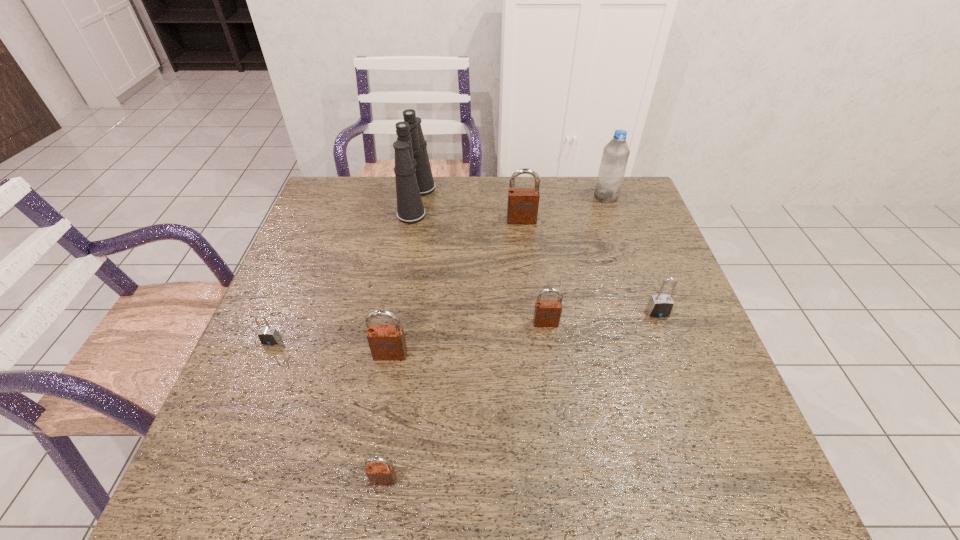
Identify the location of vacant space located 0.120m on the front-facing side of the fifth farthest object. (552, 370).

The height and width of the screenshot is (540, 960). I want to click on free space located 0.300m on the shackle of the third nearest padlock, so click(x=214, y=480).

Locate an element on the screen. Image resolution: width=960 pixels, height=540 pixels. binoculars present at the far edge is located at coordinates (413, 175).

Locate an element on the screen. The height and width of the screenshot is (540, 960). water bottle that is at the far edge is located at coordinates (615, 156).

Where is `padlock located at the far edge`? The image size is (960, 540). padlock located at the far edge is located at coordinates (522, 208).

Image resolution: width=960 pixels, height=540 pixels. In order to click on object that is at the near edge in this screenshot , I will do 379,471.

The height and width of the screenshot is (540, 960). I want to click on object that is positioned at the left edge, so click(x=268, y=335).

Where is `water bottle at the right edge`? water bottle at the right edge is located at coordinates [x=615, y=156].

Where is `padlock located at the right edge`? The height and width of the screenshot is (540, 960). padlock located at the right edge is located at coordinates (660, 305).

Locate an element on the screen. object that is positioned at the far right corner is located at coordinates (615, 156).